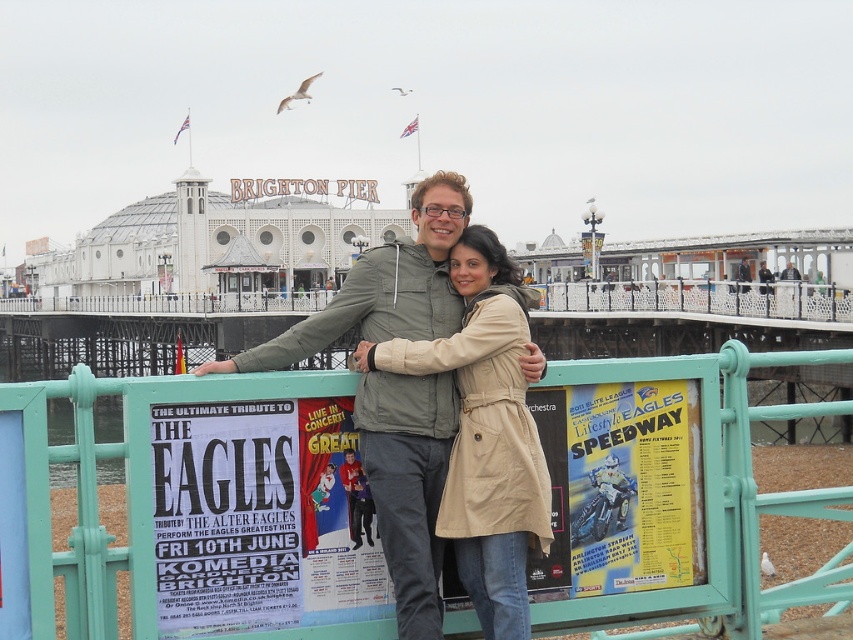
Question: Does teal metal fence at center appear on the right side of white paper poster at center?

Choices:
 (A) yes
 (B) no

Answer: (A)

Question: Which object is the farthest from the beige fabric coat at center?

Choices:
 (A) green matte jacket at center
 (B) white paper poster at center

Answer: (A)

Question: Which point is closer to the camera?

Choices:
 (A) (675, 403)
 (B) (198, 586)

Answer: (B)

Question: Which is nearer to the white paper poster at center?

Choices:
 (A) green matte jacket at center
 (B) yellow paper poster at lower right

Answer: (A)

Question: Is beige fabric coat at center bigger than yellow paper poster at lower right?

Choices:
 (A) no
 (B) yes

Answer: (A)

Question: Is teal metal fence at center positioned before white paper poster at center?

Choices:
 (A) yes
 (B) no

Answer: (A)